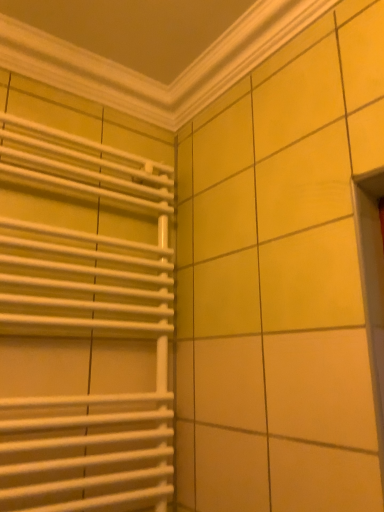
In order to face white matte towel rack at left, should I rotate leftwards or rightwards?

Rotate left and turn 12.865 degrees.

What are the coordinates of `white matte towel rack at left` in the screenshot? It's located at (82, 310).

Describe the element at coordinates (82, 310) in the screenshot. I see `white matte towel rack at left` at that location.

Where is `white matte towel rack at left`? white matte towel rack at left is located at coordinates (82, 310).